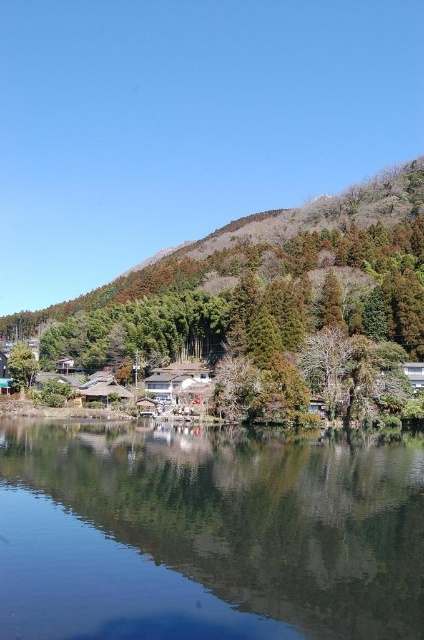
Between point (114, 451) and point (332, 225), which one is positioned behind?

The point (332, 225) is more distant.

Is transparent glass water at lower center in front of green leafy hillside at upper center?

Yes, it is in front of green leafy hillside at upper center.

You are a GUI agent. You are given a task and a screenshot of the screen. Output one action in this format:
    pyautogui.click(x=<x>, y=<y>)
    Task: Click on the transparent glass water at lower center
    The width and height of the screenshot is (424, 640).
    Given the screenshot: What is the action you would take?
    pyautogui.click(x=209, y=534)

This screenshot has height=640, width=424. I want to click on transparent glass water at lower center, so click(x=209, y=534).